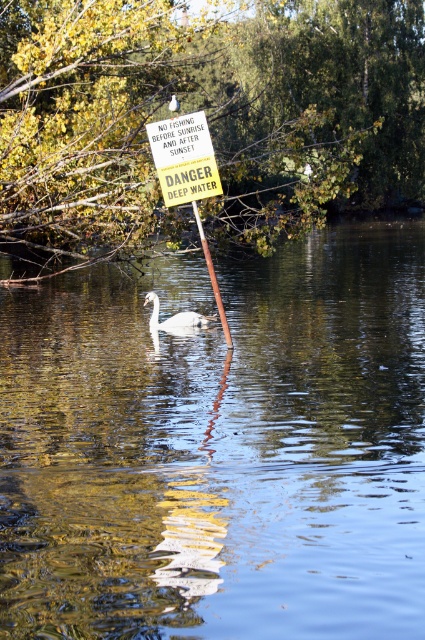
Question: Is yellow paper sign at center closer to the viewer compared to white glossy swan at center?

Choices:
 (A) yes
 (B) no

Answer: (A)

Question: Estimate the real-world distances between objects in this image. Which object is closer to the white glossy swan at center?

Choices:
 (A) yellow paper sign at center
 (B) wooden pole at center
 (C) clear water at center

Answer: (C)

Question: Is yellow paper sign at center above wooden pole at center?

Choices:
 (A) yes
 (B) no

Answer: (A)

Question: Is yellow paper sign at center positioned in front of white glossy swan at center?

Choices:
 (A) yes
 (B) no

Answer: (A)

Question: Which is nearer to the yellow paper sign at center?

Choices:
 (A) clear water at center
 (B) white glossy swan at center
 (C) wooden pole at center

Answer: (C)

Question: Which object is farther from the camera taking this photo?

Choices:
 (A) wooden pole at center
 (B) white glossy swan at center
 (C) clear water at center

Answer: (B)